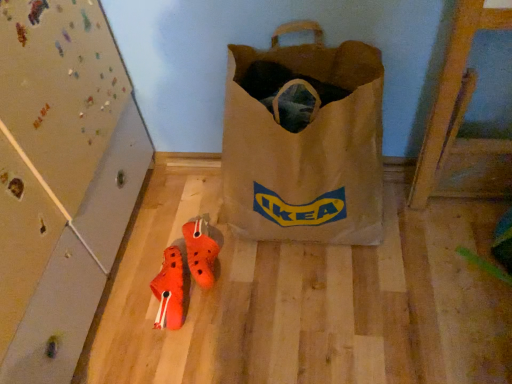
Image resolution: width=512 pixels, height=384 pixels. I want to click on free location in front of orange matte sneakers at lower center, arranged as the first footwear when viewed from the left, so click(x=174, y=354).